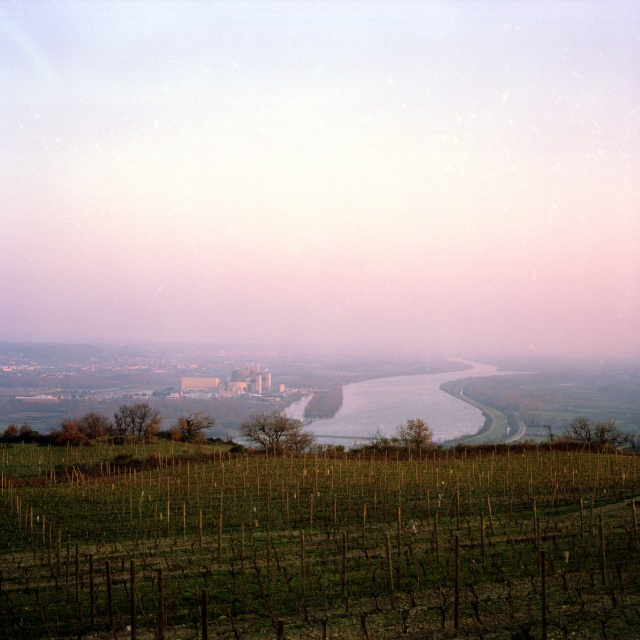
You are standing in the vineyard and see two points marked in the image. Which point is closer to you, point (x=310, y=468) or point (x=380, y=428)?

Point (x=310, y=468) is in front of point (x=380, y=428), so it is closer to you.

You are standing at the center of the image and want to walk towards the green grassy vineyard at lower center. In which direction should you move?

The green grassy vineyard at lower center is located at point 0.850 on the x axis and 0.500 on the y axis. Since you are at the center, you should move towards the lower right direction to reach it.